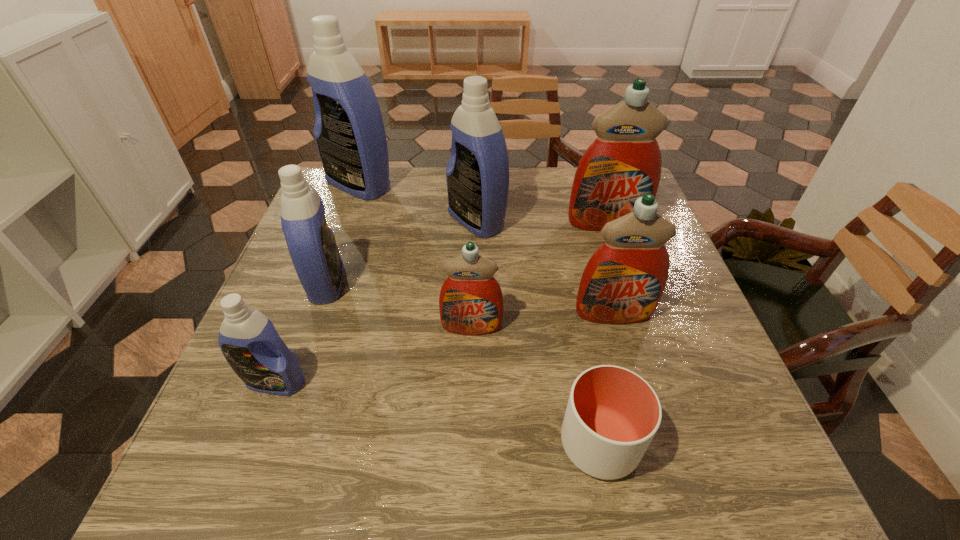
You are a GUI agent. You are given a task and a screenshot of the screen. Output one action in this format:
    pyautogui.click(x=<x>, y=<y>)
    Task: Click on the shortest object
    Image resolution: width=960 pixels, height=540 pixels.
    Given the screenshot: What is the action you would take?
    pyautogui.click(x=612, y=415)

This screenshot has height=540, width=960. I want to click on free space located 0.190m on the front of the biggest blue detergent, so click(x=337, y=246).

This screenshot has height=540, width=960. I want to click on vacant region located on the front of the rightmost blue detergent, so click(475, 330).

Locate an element on the screen. This screenshot has width=960, height=540. vacant space positioned 0.090m on the front surface of the farthest red detergent is located at coordinates (617, 257).

Find the location of a particular element. vacant space located 0.160m on the back of the third farthest blue detergent is located at coordinates (348, 222).

The width and height of the screenshot is (960, 540). I want to click on free spot located on the front surface of the second smallest red detergent, so click(625, 354).

This screenshot has width=960, height=540. Identify the location of free space located on the right of the nearest blue detergent. (422, 382).

Find the location of a particular element. This screenshot has height=540, width=960. vacant space located 0.200m on the front surface of the leftmost red detergent is located at coordinates (470, 429).

You are a GUI agent. You are given a task and a screenshot of the screen. Output one action in this format:
    pyautogui.click(x=<x>, y=<y>)
    Task: Click on the free region located 0.120m on the left of the cup
    Image resolution: width=960 pixels, height=540 pixels.
    Given the screenshot: What is the action you would take?
    pyautogui.click(x=489, y=443)

At what (x,y) coordinates should I click in order to perform the action: click on object located in the near edge section of the desktop. Please return your answer as a coordinate pair (x, y). Looking at the image, I should click on (612, 415).